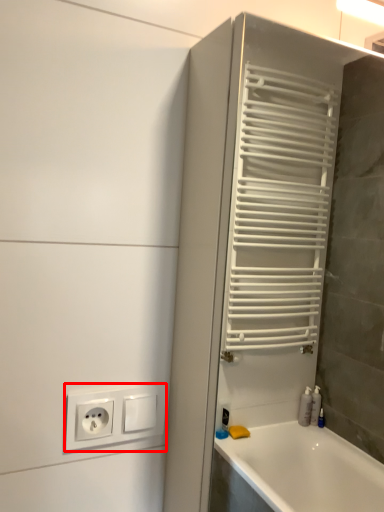
Question: Considering the relative positions of power plugs and sockets (annotated by the red box) and screen door in the image provided, where is power plugs and sockets (annotated by the red box) located with respect to the staircase?

Choices:
 (A) left
 (B) right

Answer: (A)